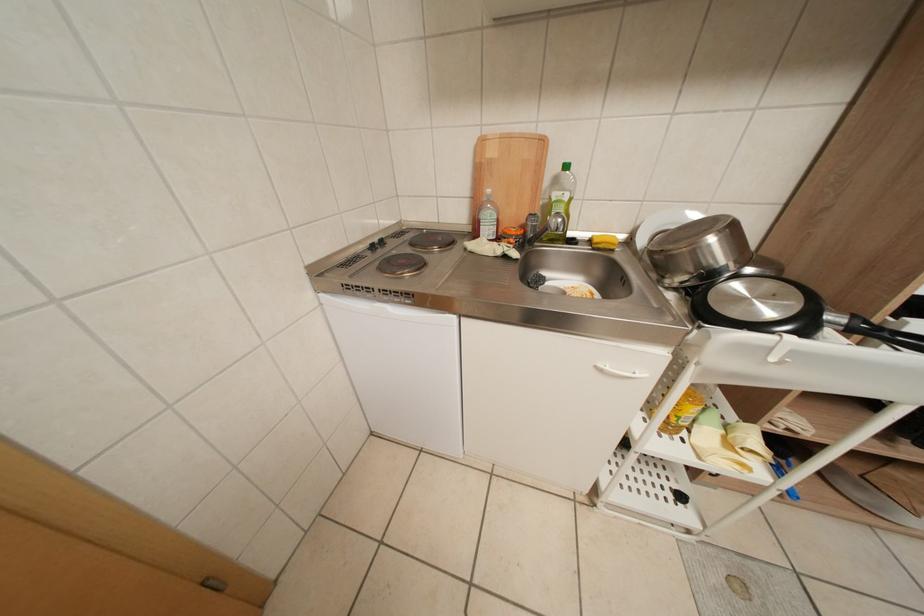
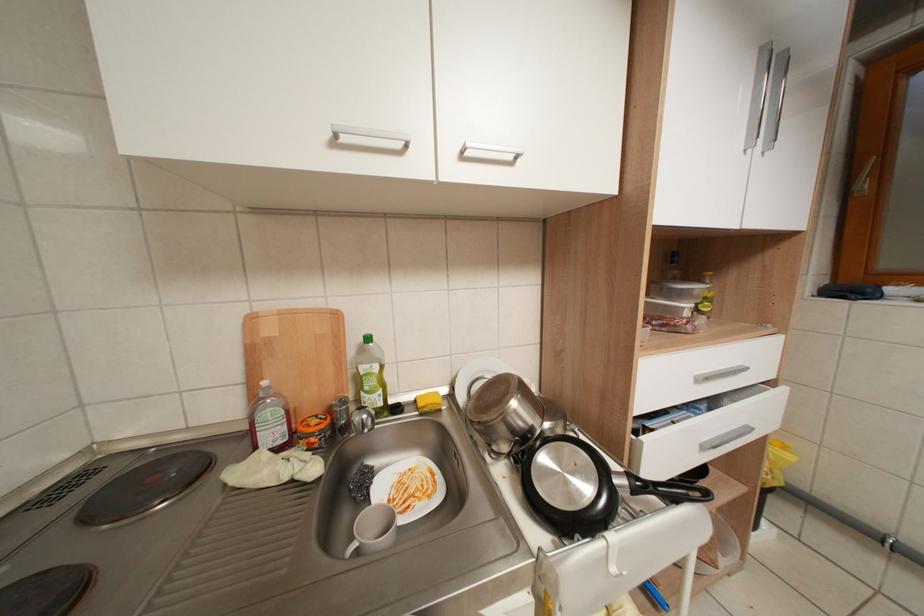
Based on the continuous images, in which direction is the camera rotating?

The camera rotated toward right-up.